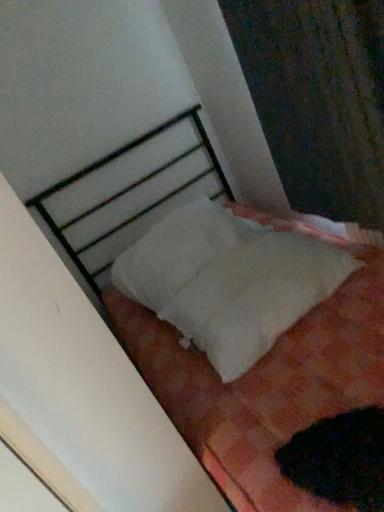
Question: Is white soft pillow at center shorter than black fuzzy cat at lower right?

Choices:
 (A) yes
 (B) no

Answer: (B)

Question: Is black fuzzy cat at lower right a part of white soft pillow at center?

Choices:
 (A) yes
 (B) no

Answer: (B)

Question: Is white soft pillow at center at the right side of black fuzzy cat at lower right?

Choices:
 (A) no
 (B) yes

Answer: (A)

Question: From a real-world perspective, is white soft pillow at center on black fuzzy cat at lower right?

Choices:
 (A) yes
 (B) no

Answer: (A)

Question: Is white soft pillow at center at the left side of black fuzzy cat at lower right?

Choices:
 (A) yes
 (B) no

Answer: (A)

Question: From a real-world perspective, relative to white soft fabric at center, is white soft pillow at center vertically above or below?

Choices:
 (A) below
 (B) above

Answer: (B)

Question: Does point (218, 248) appear closer or farther from the camera than point (246, 351)?

Choices:
 (A) closer
 (B) farther

Answer: (B)

Question: Is white soft pillow at center bigger or smaller than white soft fabric at center?

Choices:
 (A) small
 (B) big

Answer: (B)

Question: In terms of width, does white soft pillow at center look wider or thinner when compared to white soft fabric at center?

Choices:
 (A) wide
 (B) thin

Answer: (A)

Question: From a real-world perspective, is white soft pillow at center physically located above or below white fabric curtain at upper right?

Choices:
 (A) above
 (B) below

Answer: (B)

Question: Is white soft pillow at center wider or thinner than white fabric curtain at upper right?

Choices:
 (A) thin
 (B) wide

Answer: (B)

Question: Is white soft pillow at center taller or shorter than white fabric curtain at upper right?

Choices:
 (A) short
 (B) tall

Answer: (A)

Question: Is white soft pillow at center to the left or to the right of white fabric curtain at upper right in the image?

Choices:
 (A) right
 (B) left

Answer: (B)

Question: From the image's perspective, is black fuzzy cat at lower right positioned above or below white soft fabric at center?

Choices:
 (A) above
 (B) below

Answer: (B)

Question: In the image, is black fuzzy cat at lower right on the left side or the right side of white soft fabric at center?

Choices:
 (A) left
 (B) right

Answer: (B)